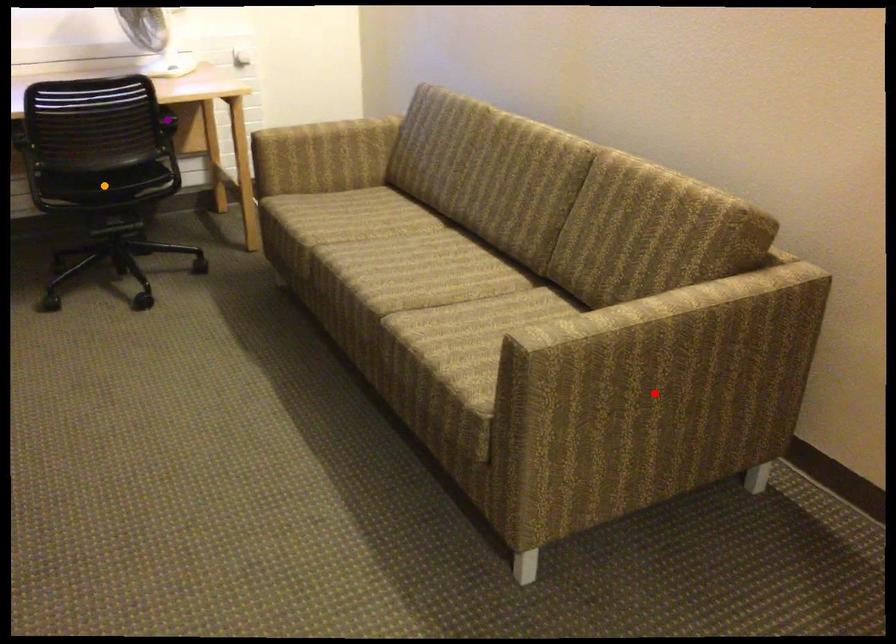
Order these from nearest to farthest:
A) purple point
B) red point
C) orange point

red point, purple point, orange point